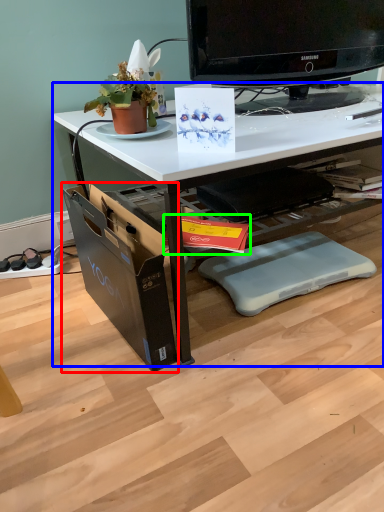
Question: Which object is positioned farthest from file cabinet (highlighted by a red box)? Select from desk (highlighted by a blue box) and magazine (highlighted by a green box).

Choices:
 (A) desk
 (B) magazine

Answer: (A)